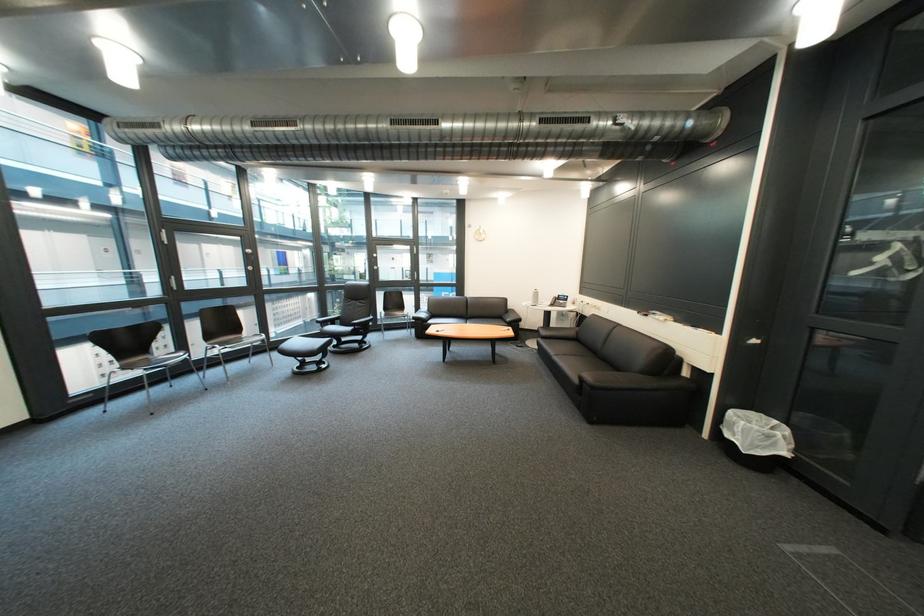
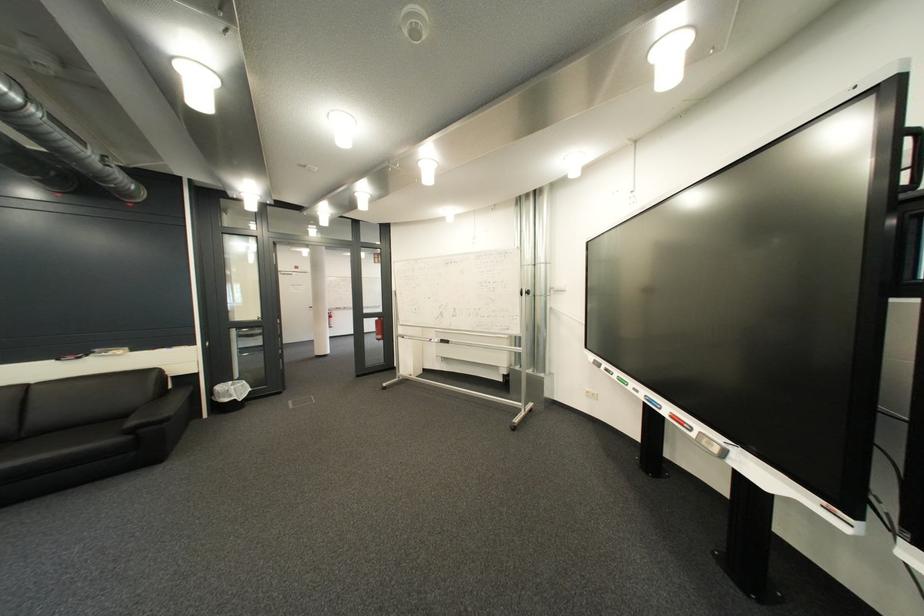
Locate, in the second image, the point that corresponds to the point at 789,424 in the first image.

(245, 384)